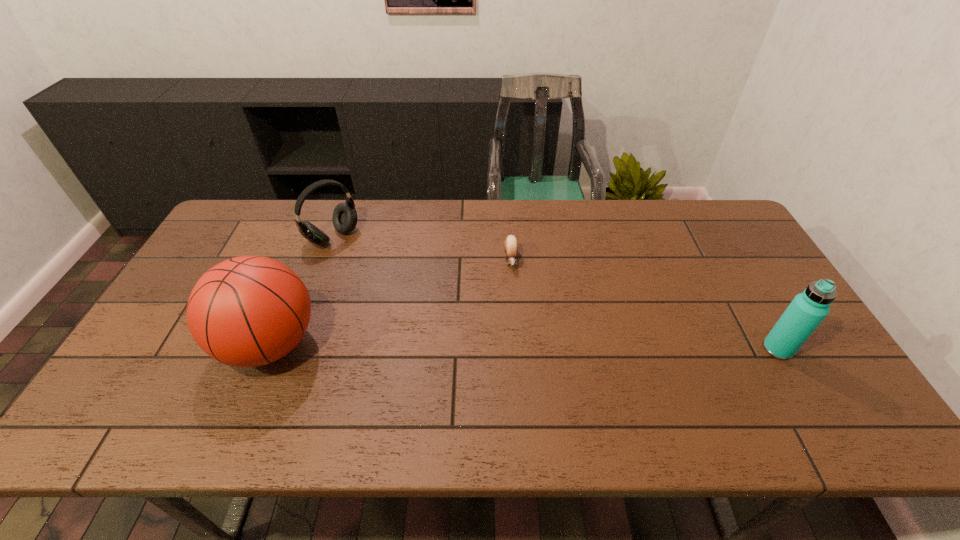
You are a GUI agent. You are given a task and a screenshot of the screen. Output one action in this format:
    pyautogui.click(x=<x>, y=<y>)
    Task: Click on the object that can be found as the second closest to the escargot
    This screenshot has height=540, width=960.
    Given the screenshot: What is the action you would take?
    pyautogui.click(x=248, y=311)

Where is `vacant area in the image that satisfies the following two spatial constraints: 1. on the back side of the third object from left to right; 2. on the right side of the basketball`? vacant area in the image that satisfies the following two spatial constraints: 1. on the back side of the third object from left to right; 2. on the right side of the basketball is located at coordinates (305, 260).

Locate an element on the screen. Image resolution: width=960 pixels, height=540 pixels. vacant area in the image that satisfies the following two spatial constraints: 1. on the back side of the basketball; 2. on the right side of the escargot is located at coordinates (305, 260).